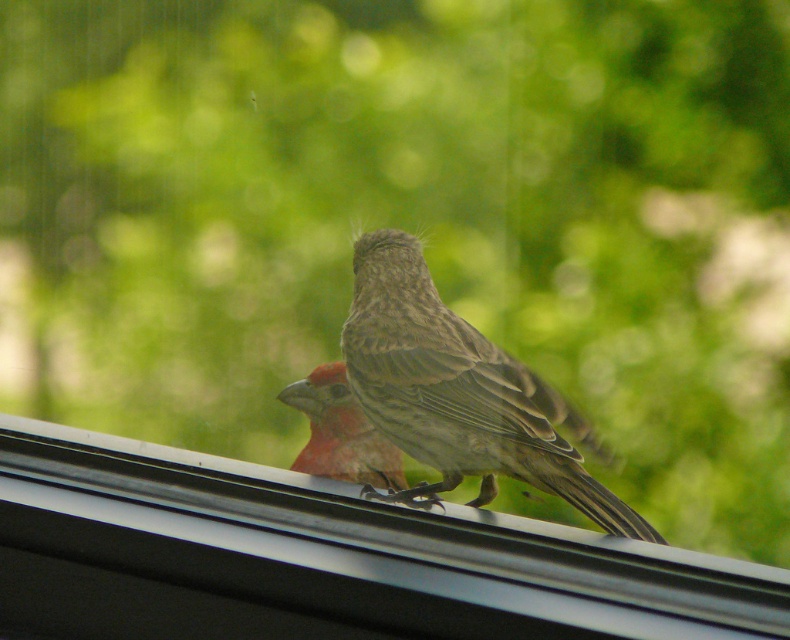
Question: Can you confirm if black plastic window sill at upper center is positioned above brown speckled sparrow at center?

Choices:
 (A) no
 (B) yes

Answer: (A)

Question: Which point appears closest to the camera in this image?

Choices:
 (A) (412, 550)
 (B) (518, 394)

Answer: (A)

Question: Which of the following is the closest to the observer?

Choices:
 (A) black plastic window sill at upper center
 (B) brown speckled sparrow at center

Answer: (A)

Question: Where is black plastic window sill at upper center located in relation to brown speckled sparrow at center in the image?

Choices:
 (A) below
 (B) above

Answer: (A)

Question: Does black plastic window sill at upper center appear on the right side of brown speckled sparrow at center?

Choices:
 (A) no
 (B) yes

Answer: (A)

Question: Which point is closer to the camera taking this photo?

Choices:
 (A) (646, 582)
 (B) (514, 381)

Answer: (A)